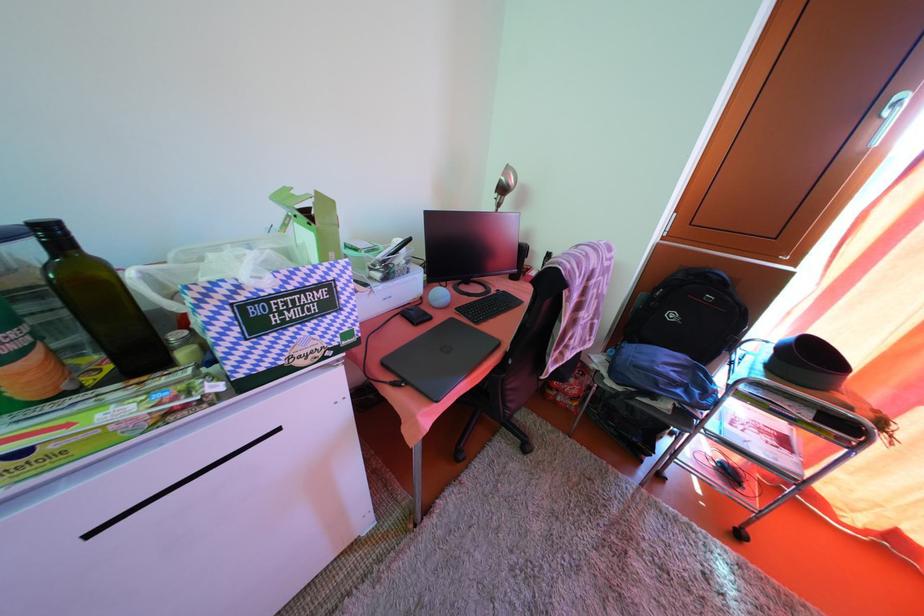
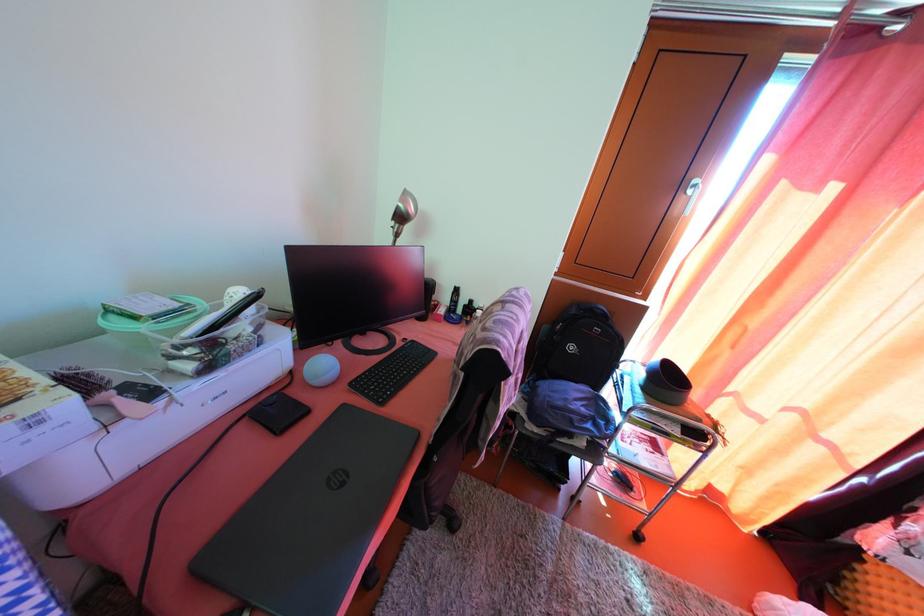
Question: In a continuous first-person perspective shot, in which direction is the camera moving?

Choices:
 (A) Left
 (B) Right
 (C) Forward
 (D) Backward

Answer: (C)